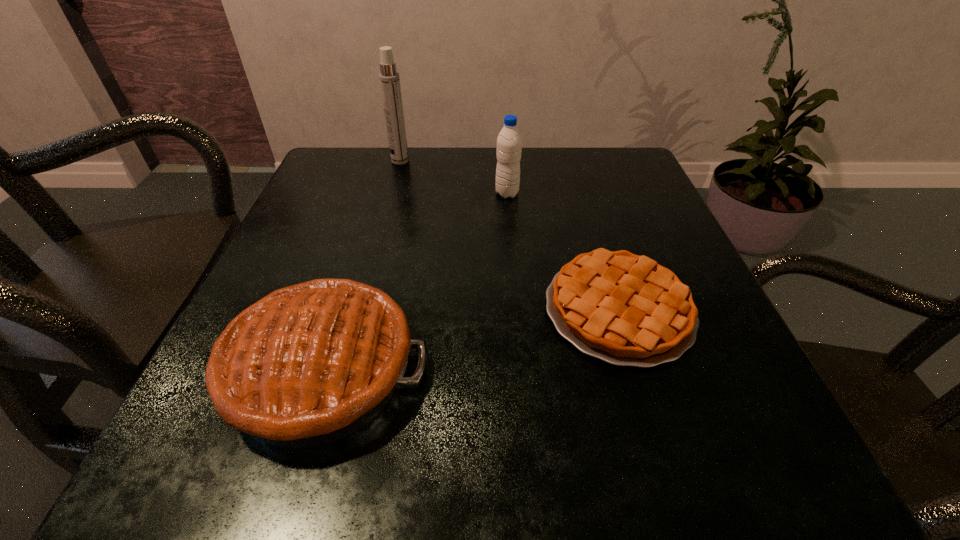
Locate an element on the screen. Image resolution: width=960 pixels, height=540 pixels. the farthest object is located at coordinates (389, 78).

In order to click on aerosol can in this screenshot , I will do `click(389, 78)`.

Locate an element on the screen. This screenshot has height=540, width=960. the third shortest object is located at coordinates (509, 142).

Locate an element on the screen. The image size is (960, 540). the third nearest object is located at coordinates (509, 142).

Where is `the left pie`? The width and height of the screenshot is (960, 540). the left pie is located at coordinates (308, 364).

You are a GUI agent. You are given a task and a screenshot of the screen. Output one action in this format:
    pyautogui.click(x=<x>, y=<y>)
    Task: Click on the taller pie
    This screenshot has height=540, width=960.
    Given the screenshot: What is the action you would take?
    pyautogui.click(x=308, y=364)

I want to click on the shortest object, so click(625, 309).

Where is `the rightmost object`? the rightmost object is located at coordinates (625, 309).

You are a GUI agent. You are given a task and a screenshot of the screen. Output one action in this format:
    pyautogui.click(x=<x>, y=<y>)
    Task: Click on the vacant area situated 0.310m on the front of the farthest object
    
    Given the screenshot: What is the action you would take?
    pyautogui.click(x=376, y=249)

The height and width of the screenshot is (540, 960). Identify the location of vacant space located 0.100m on the left of the second farthest object. (448, 193).